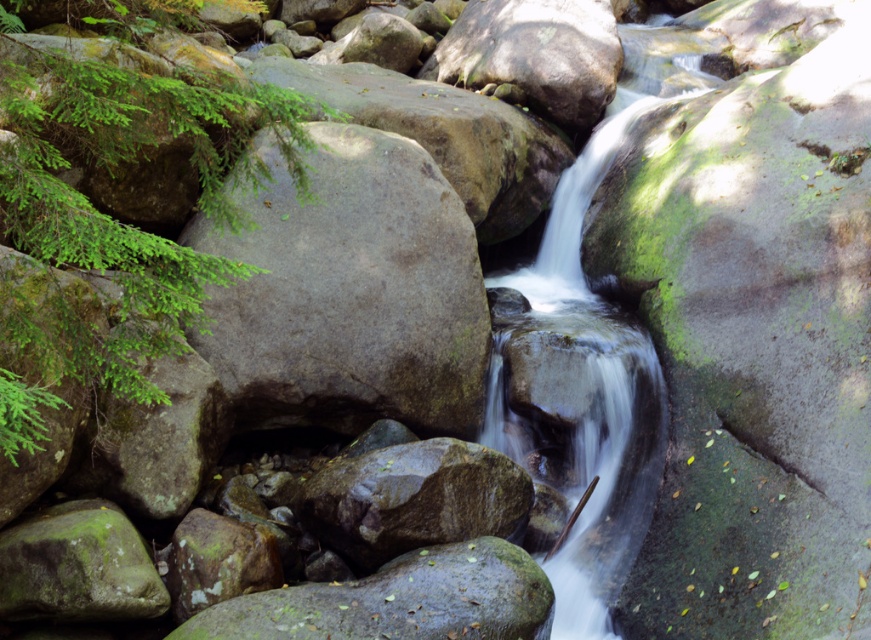
Which is behind, point (231, 323) or point (586, 316)?

Positioned behind is point (586, 316).

Is gray rough boulder at center-left to the right of clear water at center from the viewer's perspective?

Incorrect, gray rough boulder at center-left is not on the right side of clear water at center.

Which is behind, point (353, 342) or point (591, 186)?

Positioned behind is point (591, 186).

The height and width of the screenshot is (640, 871). I want to click on gray rough boulder at center-left, so click(349, 292).

Is gray rough boulder at center-left to the right of green mossy rock at center from the viewer's perspective?

No, gray rough boulder at center-left is not to the right of green mossy rock at center.

Does gray rough boulder at center-left appear over green mossy rock at center?

Yes, gray rough boulder at center-left is above green mossy rock at center.

Where is `gray rough boulder at center-left`? The width and height of the screenshot is (871, 640). gray rough boulder at center-left is located at coordinates (349, 292).

Is clear water at center thinner than green mossy rock at center?

Correct, clear water at center's width is less than green mossy rock at center's.

Is point (615, 637) positioned behind point (545, 621)?

That is True.

Is point (603, 564) closer to viewer compared to point (332, 596)?

No.

Where is `clear water at center`? The width and height of the screenshot is (871, 640). clear water at center is located at coordinates (593, 372).